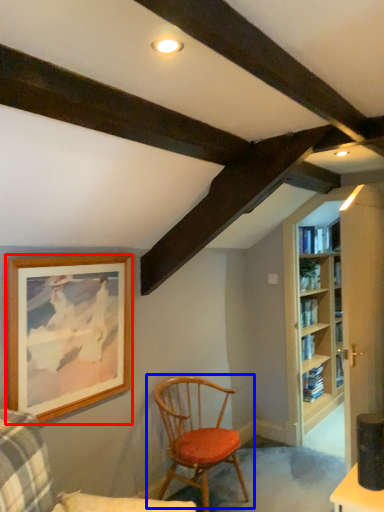
Question: Which of the following is the closest to the observer, picture frame (highlighted by a red box) or chair (highlighted by a blue box)?

Choices:
 (A) picture frame
 (B) chair

Answer: (A)